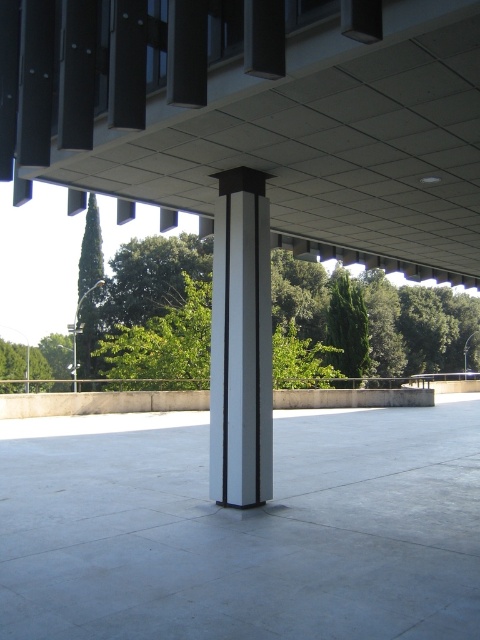
You are standing in front of the modern building structure looking at the column with black vertical stripes. There are two points marked on the column. One is at coordinate point (433,582) and the other is at point (81,337). Which of these points is nearer to your viewpoint?

Point (433,582) is closer to the camera than point (81,337), so the point at coordinate point (433,582) is nearer to your viewpoint.

You are standing in front of the modern building structure. You see two points marked on the column with black vertical stripes. The first point is at coordinate point (x=240, y=556) and the second point is at coordinate point (x=248, y=445). Which point is closer to you?

Point (x=240, y=556) is closer to the viewer than point (x=248, y=445).